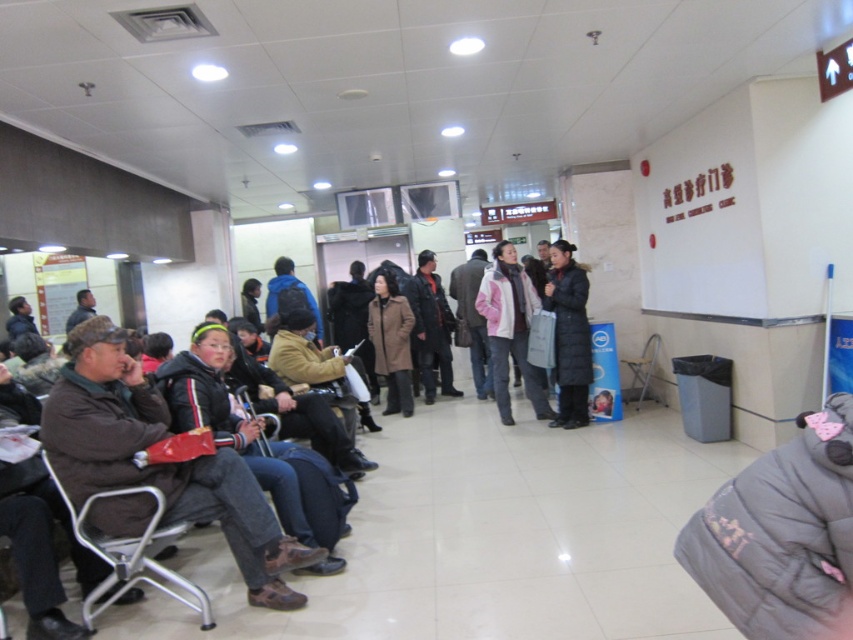
Question: Among these objects, which one is nearest to the camera?

Choices:
 (A) black puffy coat at center
 (B) silver metallic chair at lower left
 (C) brown wool coat at center

Answer: (B)

Question: Can you confirm if silver metallic chair at lower left is bigger than metallic gray chair at center?

Choices:
 (A) no
 (B) yes

Answer: (B)

Question: Can you confirm if pink matte jacket at center is thinner than brown wool coat at center?

Choices:
 (A) yes
 (B) no

Answer: (B)

Question: Which object is closer to the camera taking this photo?

Choices:
 (A) brown woolen jacket at left
 (B) black puffy coat at center

Answer: (A)

Question: Which of the following is the closest to the observer?

Choices:
 (A) black puffy coat at center
 (B) pink matte jacket at center

Answer: (A)

Question: Does pink matte jacket at center lie in front of metallic gray chair at center?

Choices:
 (A) yes
 (B) no

Answer: (A)